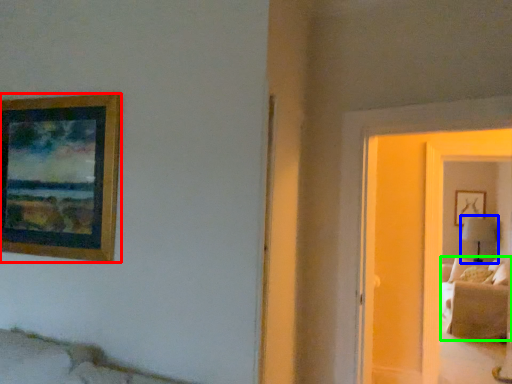
Question: Which object is the closest to the picture frame (highlighted by a red box)? Choose among these: table lamp (highlighted by a blue box) or couch (highlighted by a green box).

Choices:
 (A) table lamp
 (B) couch

Answer: (B)